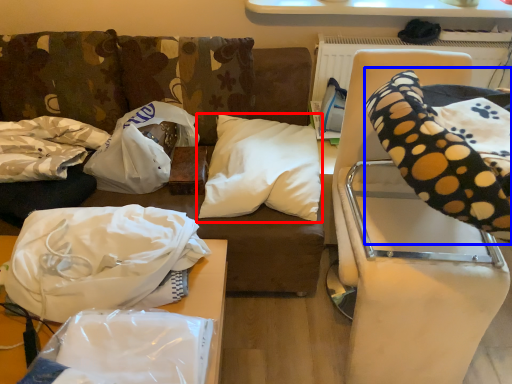
Question: Which point is further to the camera, pillow (highlighted by a red box) or bean bag chair (highlighted by a blue box)?

Choices:
 (A) pillow
 (B) bean bag chair

Answer: (A)